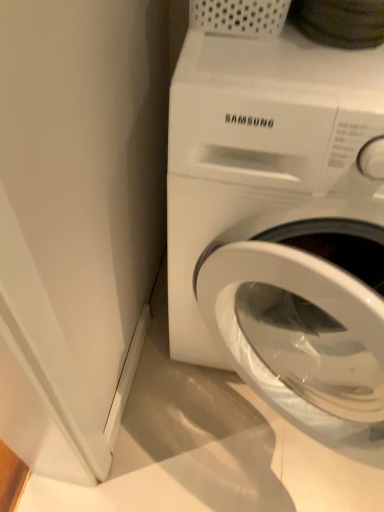
The image size is (384, 512). Describe the element at coordinates (278, 218) in the screenshot. I see `white glossy washing machine at center` at that location.

What is the approximate width of white glossy washing machine at center?

It is 29.45 inches.

You are a GUI agent. You are given a task and a screenshot of the screen. Output one action in this format:
    pyautogui.click(x=<x>, y=<y>)
    Task: Click on the white glossy washing machine at center
    
    Given the screenshot: What is the action you would take?
    (x=278, y=218)

Where is `white glossy washing machine at center`? This screenshot has height=512, width=384. white glossy washing machine at center is located at coordinates (278, 218).